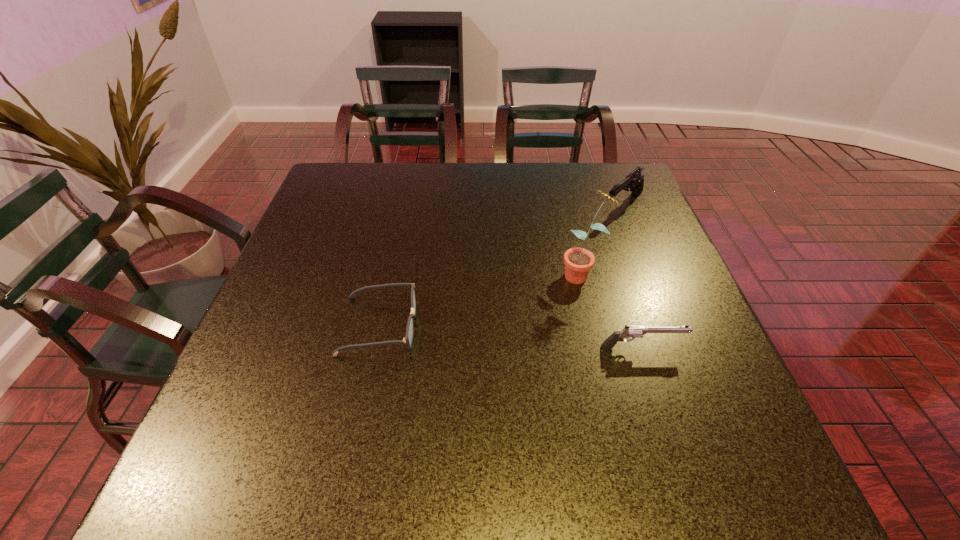
Find the location of a particular element. vacant space at the near edge is located at coordinates (551, 404).

Identify the location of vacant space at the left edge of the desktop. (324, 324).

The image size is (960, 540). Identify the location of vacant space at the right edge. (671, 300).

Where is `vacant space at the far left corner`? This screenshot has width=960, height=540. vacant space at the far left corner is located at coordinates (355, 173).

Locate an element on the screen. The width and height of the screenshot is (960, 540). free space at the near left corner of the desktop is located at coordinates coord(269,418).

Identify the location of free space at the far right corner of the desktop. (614, 167).

Identify the location of free region at the near right corner. (676, 419).

Find the location of a particular element. This screenshot has height=540, width=960. empty location between the sunflower and the third shortest object is located at coordinates (603, 239).

Locate an element on the screen. This screenshot has height=540, width=960. empty location between the pistol and the leftmost object is located at coordinates (511, 336).

Where is `empty space between the third tallest object and the spectacles`? empty space between the third tallest object and the spectacles is located at coordinates (511, 336).